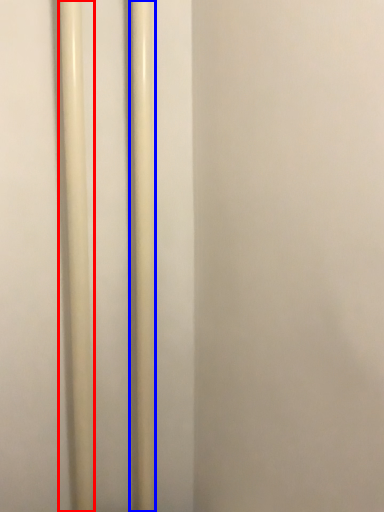
Question: Among these objects, which one is nearest to the camera, pole (highlighted by a red box) or pole (highlighted by a blue box)?

Choices:
 (A) pole
 (B) pole

Answer: (A)